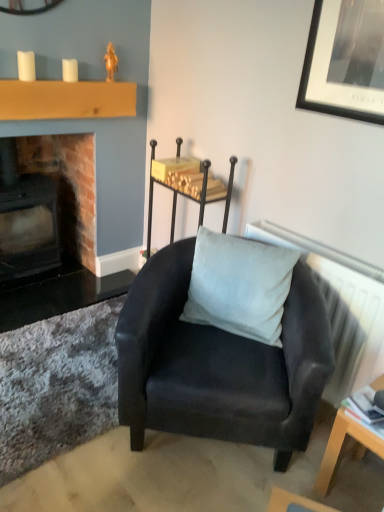
You are a GUI agent. You are given a task and a screenshot of the screen. Output one action in this format:
    pyautogui.click(x=<x>, y=<y>)
    Task: Click on the light wood/wooden table at lower right
    The height and width of the screenshot is (512, 384).
    Given the screenshot: What is the action you would take?
    pyautogui.click(x=344, y=449)

Image resolution: width=384 pixels, height=512 pixels. What are the coordinates of `matte black armchair at center` in the screenshot? It's located at (219, 364).

What do you see at coordinates (188, 186) in the screenshot? This screenshot has width=384, height=512. I see `satin black chair at center` at bounding box center [188, 186].

Locate an element on the screen. The image size is (384, 512). wooden mantle at upper left is located at coordinates (66, 100).

The height and width of the screenshot is (512, 384). I want to click on satin white pillow at center, so click(239, 285).

I want to click on light wood/wooden table at lower right, so click(x=344, y=449).

Is brick fireplace at left next to matte black armchair at center?

No, brick fireplace at left is not making contact with matte black armchair at center.

Between point (66, 195) and point (246, 351), which one is positioned in front?

Positioned in front is point (246, 351).

Considering the sizes of objects brick fireplace at left and matte black armchair at center in the image provided, who is thinner, brick fireplace at left or matte black armchair at center?

brick fireplace at left is thinner.

Considering the relative sizes of satin black chair at center and white textured radiator at upper right in the image provided, is satin black chair at center shorter than white textured radiator at upper right?

No.

Is satin black chair at center behind white textured radiator at upper right?

Yes, the depth of satin black chair at center is greater than that of white textured radiator at upper right.

Considering the sizes of satin black chair at center and white textured radiator at upper right in the image, is satin black chair at center wider or thinner than white textured radiator at upper right?

In the image, satin black chair at center appears to be wider than white textured radiator at upper right.

From the picture: How many degrees apart are the facing directions of satin black chair at center and white textured radiator at upper right?

They differ by 2.03 degrees in their facing directions.

Are wooden mantle at upper left and light wood/wooden table at lower right far apart?

wooden mantle at upper left is positioned a significant distance from light wood/wooden table at lower right.

Which object is positioned more to the left, wooden mantle at upper left or light wood/wooden table at lower right?

From the viewer's perspective, wooden mantle at upper left appears more on the left side.

Is wooden mantle at upper left positioned beyond the bounds of light wood/wooden table at lower right?

Yes.

Is wooden mantle at upper left thinner than light wood/wooden table at lower right?

Indeed, wooden mantle at upper left has a lesser width compared to light wood/wooden table at lower right.

Locate an element on the screen. pillow on the right of wooden mantle at upper left is located at coordinates (239, 285).

In terms of size, does satin white pillow at center appear bigger or smaller than wooden mantle at upper left?

In the image, satin white pillow at center appears to be larger than wooden mantle at upper left.

From the image's perspective, is satin white pillow at center on top of wooden mantle at upper left?

Actually, satin white pillow at center appears below wooden mantle at upper left in the image.

Looking at this image, do you think satin white pillow at center is within wooden mantle at upper left, or outside of it?

satin white pillow at center is outside wooden mantle at upper left.

Is brick fireplace at left next to satin white pillow at center and touching it?

brick fireplace at left is not next to satin white pillow at center, and they're not touching.

Find the location of `fireplace behind the satin white pillow at center`. fireplace behind the satin white pillow at center is located at coordinates (47, 206).

Considering the relative sizes of matte black armchair at center and satin black chair at center in the image provided, is matte black armchair at center thinner than satin black chair at center?

No, matte black armchair at center is not thinner than satin black chair at center.

Consider the image. Between matte black armchair at center and satin black chair at center, which one has larger size?

matte black armchair at center.

Is light wood/wooden table at lower right positioned with its back to satin white pillow at center?

No, light wood/wooden table at lower right is not facing the opposite direction of satin white pillow at center.

From a real-world perspective, is light wood/wooden table at lower right on satin white pillow at center?

No, from a real-world perspective, light wood/wooden table at lower right is not above satin white pillow at center.

From the picture: Considering the relative sizes of light wood/wooden table at lower right and satin white pillow at center in the image provided, is light wood/wooden table at lower right thinner than satin white pillow at center?

Incorrect, the width of light wood/wooden table at lower right is not less than that of satin white pillow at center.

Considering the positions of objects light wood/wooden table at lower right and satin white pillow at center in the image provided, who is more to the right, light wood/wooden table at lower right or satin white pillow at center?

light wood/wooden table at lower right.

There is a matte black armchair at center. Where is `fireplace above it (from a real-world perspective)`? fireplace above it (from a real-world perspective) is located at coordinates (47, 206).

Locate an element on the screen. furniture that appears behind the white textured radiator at upper right is located at coordinates (188, 186).

From the image, which object appears to be farther from satin white pillow at center, light wood/wooden table at lower right or satin black chair at center?

light wood/wooden table at lower right.

Which object lies further to the anchor point light wood/wooden table at lower right, wooden mantle at upper left or brick fireplace at left?

The object further to light wood/wooden table at lower right is brick fireplace at left.

Based on their spatial positions, is satin white pillow at center or white textured radiator at upper right closer to satin black chair at center?

satin white pillow at center.

From the image, which object appears to be farther from wooden mantle at upper left, white textured radiator at upper right or brick fireplace at left?

white textured radiator at upper right lies further to wooden mantle at upper left than the other object.

Looking at this image, when comparing their distances from brick fireplace at left, does satin white pillow at center or white textured radiator at upper right seem further?

white textured radiator at upper right is further to brick fireplace at left.

Estimate the real-world distances between objects in this image. Which object is further from white textured radiator at upper right, matte black armchair at center or wooden mantle at upper left?

The object further to white textured radiator at upper right is wooden mantle at upper left.

Looking at the image, which one is located further to brick fireplace at left, satin black chair at center or light wood/wooden table at lower right?

light wood/wooden table at lower right is positioned further to the anchor brick fireplace at left.

In the scene shown: When comparing their distances from satin white pillow at center, does satin black chair at center or light wood/wooden table at lower right seem closer?

Based on the image, satin black chair at center appears to be nearer to satin white pillow at center.

You are a GUI agent. You are given a task and a screenshot of the screen. Output one action in this format:
    pyautogui.click(x=<x>, y=<y>)
    Task: Click on the pillow between satin black chair at center and light wood/wooden table at lower right vertically
    The height and width of the screenshot is (512, 384).
    Given the screenshot: What is the action you would take?
    pyautogui.click(x=239, y=285)

Find the location of a particular element. Image resolution: width=384 pixels, height=512 pixels. furniture located between wooden mantle at upper left and white textured radiator at upper right in the left-right direction is located at coordinates (188, 186).

Where is `pillow between satin black chair at center and white textured radiator at upper right in the horizontal direction`? pillow between satin black chair at center and white textured radiator at upper right in the horizontal direction is located at coordinates (239, 285).

Where is `furniture that lies between wooden mantle at upper left and satin white pillow at center from top to bottom`? Image resolution: width=384 pixels, height=512 pixels. furniture that lies between wooden mantle at upper left and satin white pillow at center from top to bottom is located at coordinates (188, 186).